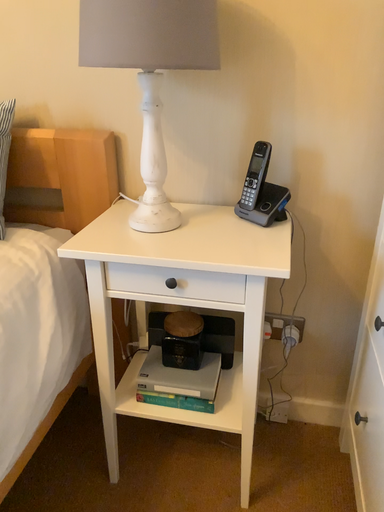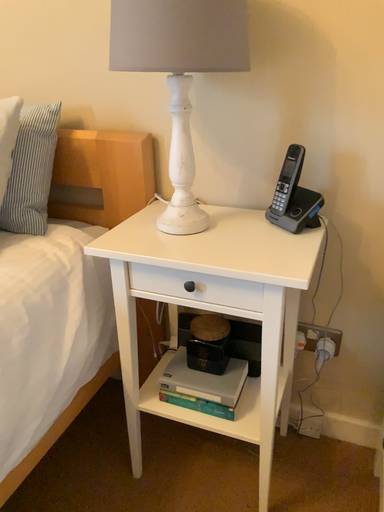
Question: How did the camera likely rotate when shooting the video?

Choices:
 (A) rotated left
 (B) rotated right

Answer: (A)